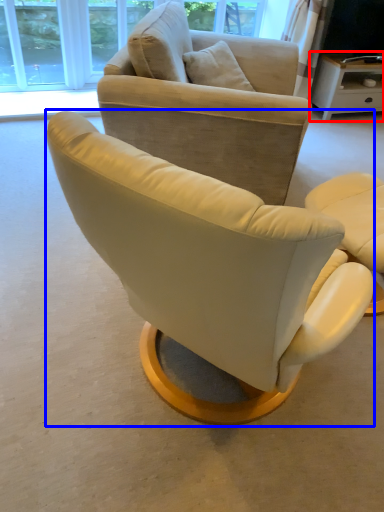
Question: Among these objects, which one is farthest to the camera, desk (highlighted by a red box) or chair (highlighted by a blue box)?

Choices:
 (A) desk
 (B) chair

Answer: (A)